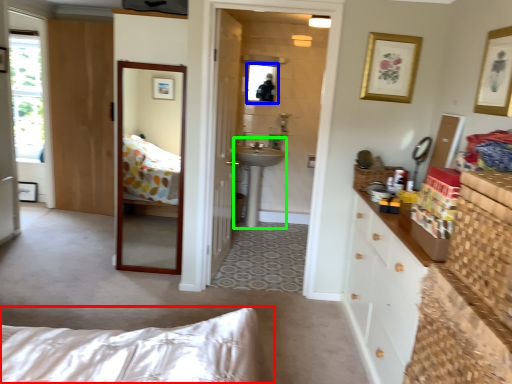
Question: Based on their relative distances, which object is nearer to bed (highlighted by a red box)? Choose from mirror (highlighted by a blue box) and sink (highlighted by a green box).

Choices:
 (A) mirror
 (B) sink

Answer: (B)